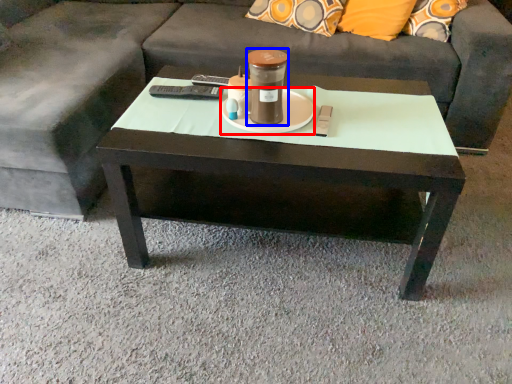
Question: Which of the following is the farthest to the observer, saucer (highlighted by a red box) or beverage (highlighted by a blue box)?

Choices:
 (A) saucer
 (B) beverage

Answer: (A)